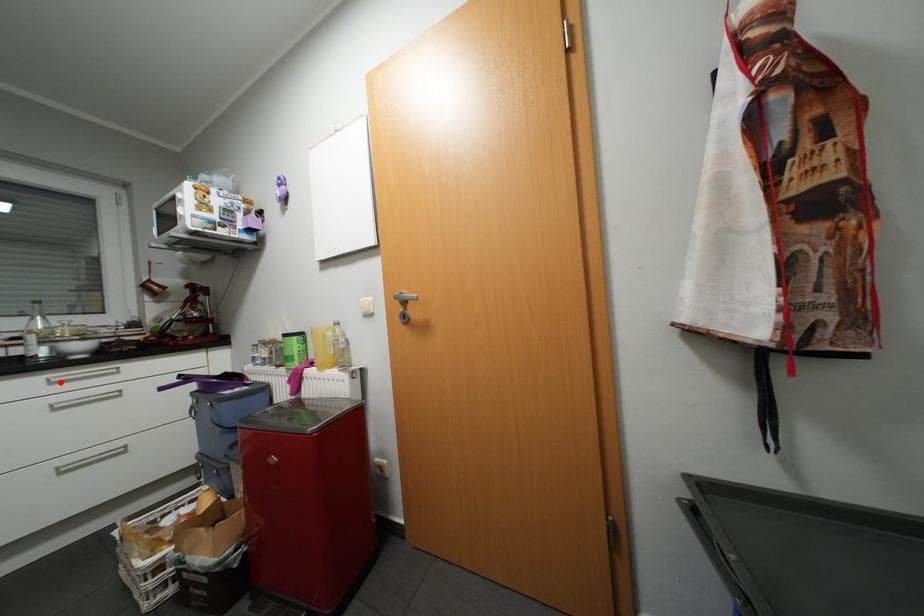
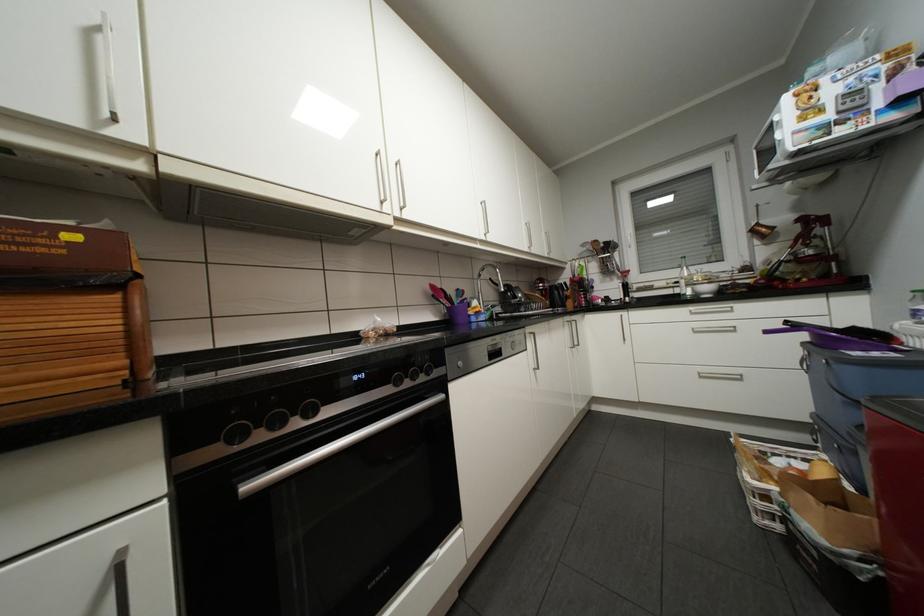
Locate, in the second image, the point that corresponds to the highlighted location in the first image.

(699, 313)